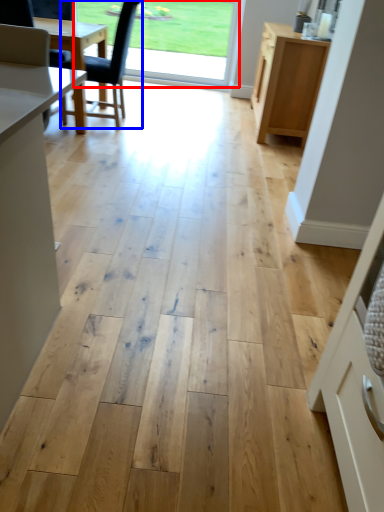
Question: Which object appears farthest to the camera in this image, window screen (highlighted by a red box) or chair (highlighted by a blue box)?

Choices:
 (A) window screen
 (B) chair

Answer: (A)